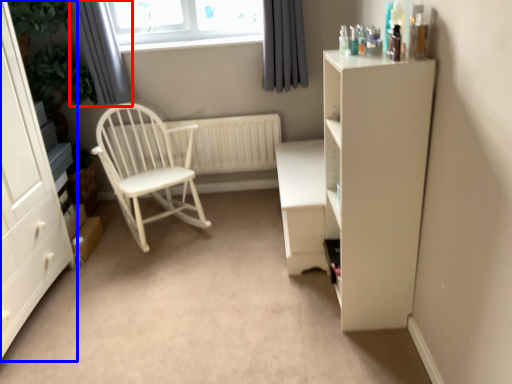
Question: Which of the following is the farthest to the observer, curtain (highlighted by a red box) or cabinetry (highlighted by a blue box)?

Choices:
 (A) curtain
 (B) cabinetry

Answer: (A)